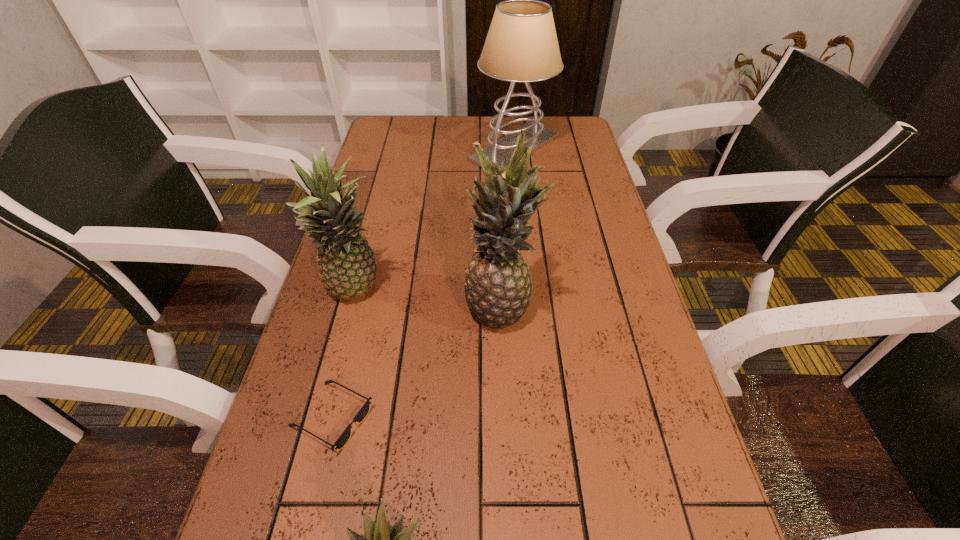
At what (x,y) coordinates should I click in order to perform the action: click on pineapple present at the left edge. Please return your answer as a coordinate pair (x, y). Looking at the image, I should click on (347, 265).

Locate an element on the screen. This screenshot has width=960, height=540. sunglasses situated at the left edge is located at coordinates (363, 412).

Image resolution: width=960 pixels, height=540 pixels. I want to click on object that is at the right edge, so click(521, 46).

What are the coordinates of `object located at the far right corner` in the screenshot? It's located at point(521,46).

This screenshot has width=960, height=540. What are the coordinates of `vacant space at the far edge` in the screenshot? It's located at (480, 131).

I want to click on blank space at the left edge of the desktop, so click(x=388, y=245).

Where is `vacant space at the right edge of the desktop`? The image size is (960, 540). vacant space at the right edge of the desktop is located at coordinates (636, 278).

Find the location of a particular element. This screenshot has width=960, height=540. vacant space at the far right corner is located at coordinates (x=588, y=145).

Where is `free spot between the fourth farthest object and the leftmost pineapple`? Image resolution: width=960 pixels, height=540 pixels. free spot between the fourth farthest object and the leftmost pineapple is located at coordinates (345, 355).

What are the coordinates of `unoccupied position between the rightmost pineapple and the shortest object` in the screenshot? It's located at (417, 363).